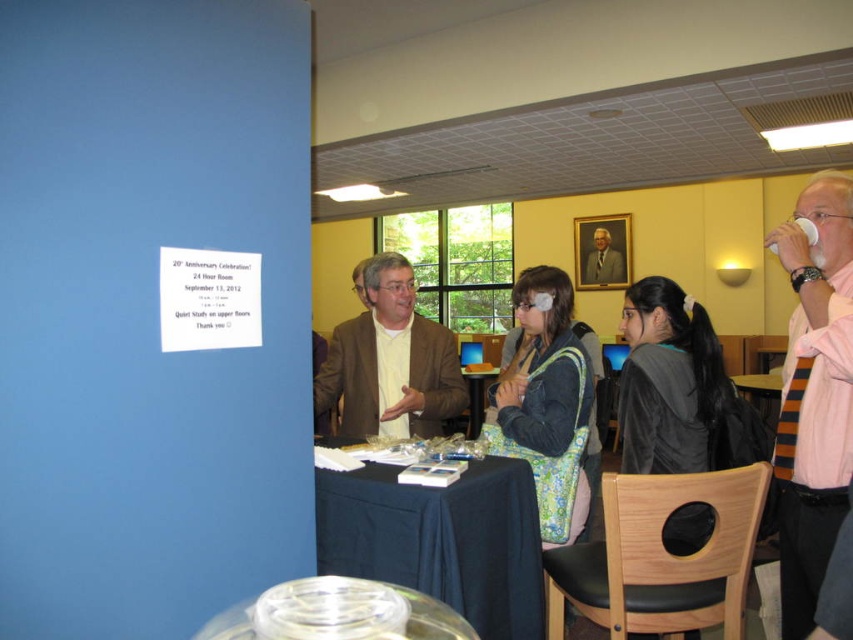
Consider the image. Is black clothed table at center to the right of formal suit at center from the viewer's perspective?

In fact, black clothed table at center is to the left of formal suit at center.

Between black clothed table at center and formal suit at center, which one is positioned lower?

black clothed table at center is below.

Who is more forward, (465, 582) or (601, 282)?

Point (465, 582)

The width and height of the screenshot is (853, 640). I want to click on black clothed table at center, so click(440, 540).

You are a GUI agent. You are given a task and a screenshot of the screen. Output one action in this format:
    pyautogui.click(x=<x>, y=<y>)
    Task: Click on the matte brown jacket at center
    
    Given the screenshot: What is the action you would take?
    pyautogui.click(x=390, y=362)

Can you confirm if matte brown jacket at center is shorter than formal suit at center?

In fact, matte brown jacket at center may be taller than formal suit at center.

The height and width of the screenshot is (640, 853). Identify the location of matte brown jacket at center. (390, 362).

Consider the image. Does pink striped tie at right have a greater height compared to black plastic table at center?

Yes, pink striped tie at right is taller than black plastic table at center.

Who is lower down, pink striped tie at right or black plastic table at center?

black plastic table at center is lower down.

I want to click on pink striped tie at right, so click(814, 394).